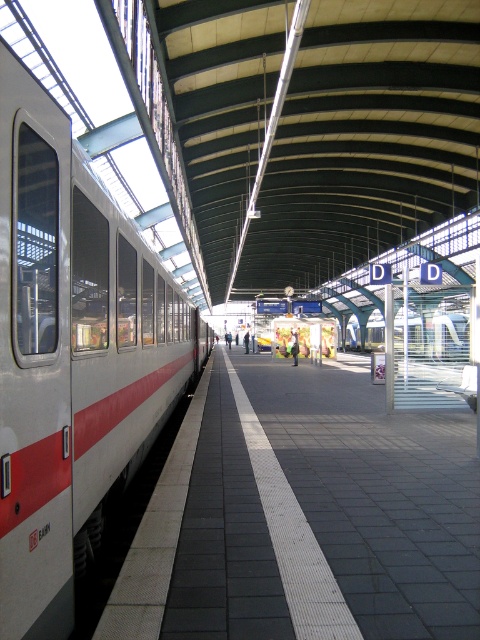
Consider the image. Can you confirm if white glossy platform at center is taller than white glossy train at left?

Incorrect, white glossy platform at center's height is not larger of white glossy train at left's.

Is white glossy platform at center shorter than white glossy train at left?

Correct, white glossy platform at center is not as tall as white glossy train at left.

Find the location of a particular element. The height and width of the screenshot is (640, 480). white glossy platform at center is located at coordinates (304, 513).

Identify the location of white glossy platform at center. (304, 513).

Which is more to the left, white glossy train at left or white glossy train at center?

white glossy train at left is more to the left.

Does point (188, 305) lie behind point (433, 348)?

Yes, it is behind point (433, 348).

You are a GUI agent. You are given a task and a screenshot of the screen. Output one action in this format:
    pyautogui.click(x=<x>, y=<y>)
    Task: Click on the white glossy train at left
    
    Given the screenshot: What is the action you would take?
    pyautogui.click(x=72, y=355)

Between white glossy platform at center and white glossy train at center, which one appears on the left side from the viewer's perspective?

Positioned to the left is white glossy platform at center.

In the scene shown: Is white glossy platform at center shorter than white glossy train at center?

Yes, white glossy platform at center is shorter than white glossy train at center.

Locate an element on the screen. The image size is (480, 640). white glossy platform at center is located at coordinates (304, 513).

Find the location of a particular element. The height and width of the screenshot is (640, 480). white glossy platform at center is located at coordinates (304, 513).